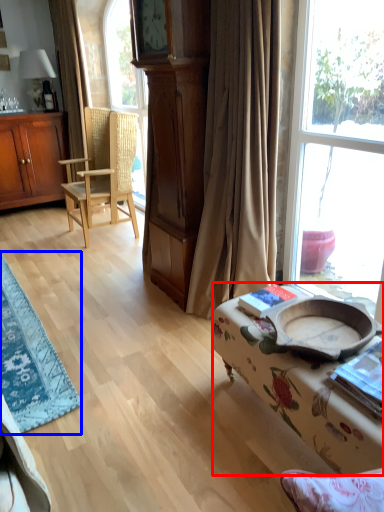
Question: Which of the following is the farthest to the observer, studio couch (highlighted by a red box) or table (highlighted by a blue box)?

Choices:
 (A) studio couch
 (B) table

Answer: (B)